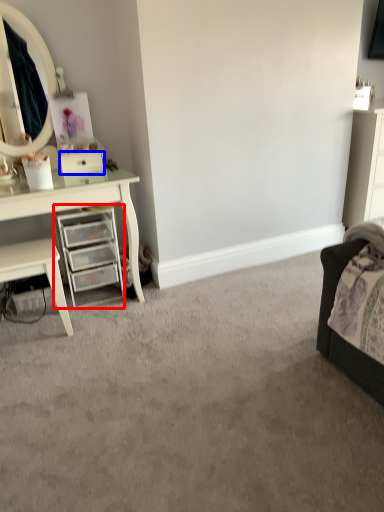
Question: Among these objects, which one is farthest to the camera, chest of drawers (highlighted by a red box) or drawer (highlighted by a blue box)?

Choices:
 (A) chest of drawers
 (B) drawer

Answer: (B)